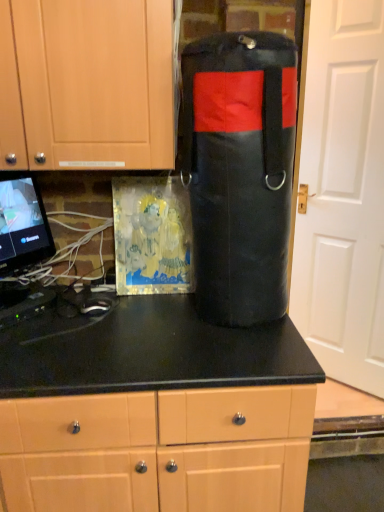
Question: Is black leather punching bag at center at the back of white matte door at right?

Choices:
 (A) no
 (B) yes

Answer: (B)

Question: Is white matte door at right outside black leather punching bag at center?

Choices:
 (A) no
 (B) yes

Answer: (B)

Question: Does white matte door at right have a smaller size compared to black leather punching bag at center?

Choices:
 (A) no
 (B) yes

Answer: (A)

Question: Can you confirm if white matte door at right is positioned to the left of black leather punching bag at center?

Choices:
 (A) yes
 (B) no

Answer: (B)

Question: Is white matte door at right aimed at black leather punching bag at center?

Choices:
 (A) yes
 (B) no

Answer: (A)

Question: From the image's perspective, is white matte door at right on black leather punching bag at center?

Choices:
 (A) no
 (B) yes

Answer: (B)

Question: Can you confirm if matte black countertop at center, the first cabinetry positioned from the bottom, is shorter than white matte door at right?

Choices:
 (A) no
 (B) yes

Answer: (B)

Question: Is the position of matte black countertop at center, the first cabinetry positioned from the bottom, less distant than that of white matte door at right?

Choices:
 (A) no
 (B) yes

Answer: (B)

Question: Considering the relative sizes of matte black countertop at center, acting as the second cabinetry starting from the top, and white matte door at right in the image provided, is matte black countertop at center, acting as the second cabinetry starting from the top, thinner than white matte door at right?

Choices:
 (A) yes
 (B) no

Answer: (B)

Question: Is matte black countertop at center, acting as the second cabinetry starting from the top, completely or partially outside of white matte door at right?

Choices:
 (A) no
 (B) yes

Answer: (B)

Question: From a real-world perspective, is matte black countertop at center, acting as the second cabinetry starting from the top, located beneath white matte door at right?

Choices:
 (A) no
 (B) yes

Answer: (B)

Question: Considering the relative sizes of matte black countertop at center, the first cabinetry positioned from the bottom, and white matte door at right in the image provided, is matte black countertop at center, the first cabinetry positioned from the bottom, smaller than white matte door at right?

Choices:
 (A) no
 (B) yes

Answer: (A)

Question: Does white matte door at right have a larger size compared to matte black countertop at center, the first cabinetry positioned from the bottom?

Choices:
 (A) yes
 (B) no

Answer: (B)